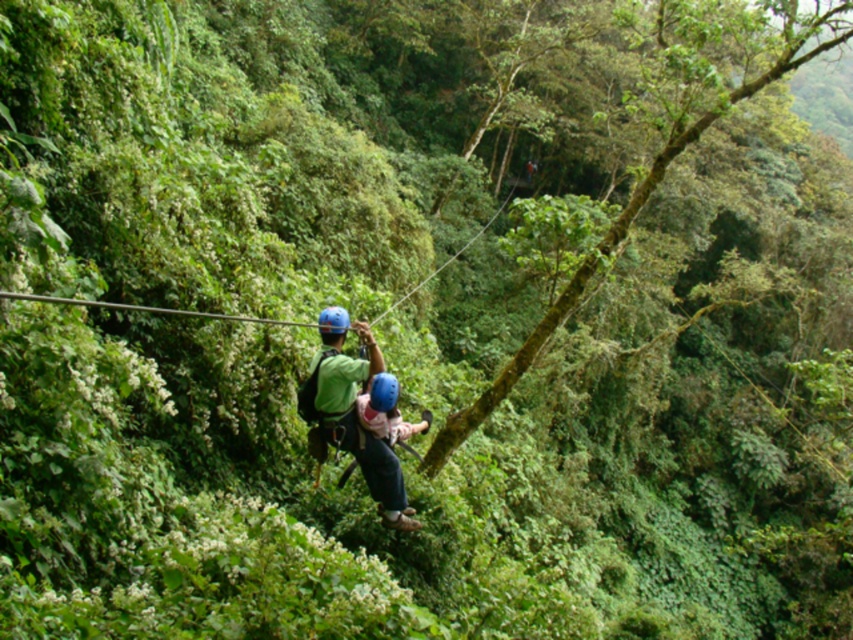
You are a hiker planning to set up a tent in this tropical rainforest scene. You notice the green mossy tree at center and the blue matte helmet at center. Which object is located higher up in the scene?

The green mossy tree at center is positioned over the blue matte helmet at center, so it is higher up in the scene.

You are a hiker planning to set up a zip line between the green mossy tree at center and the green fabric harness at center. Based on their positions, which object should you attach the starting point of the zip line to ensure it runs from left to right?

The zip line should start at the green fabric harness at center and end at the green mossy tree at center because the green mossy tree at center is to the right of the green fabric harness at center.

You are a park ranger assessing the zip line safety in the tropical rainforest scene. You notice a point marked at coordinates (351,413). What object is located at this point?

The point at coordinates (351,413) corresponds to the green fabric harness at center.